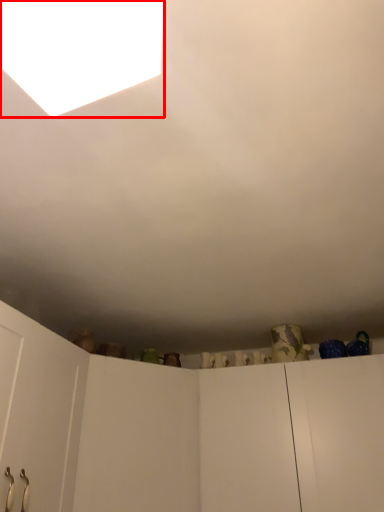
Question: From the image, what is the correct spatial relationship of light (annotated by the red box) in relation to door?

Choices:
 (A) left
 (B) right

Answer: (B)